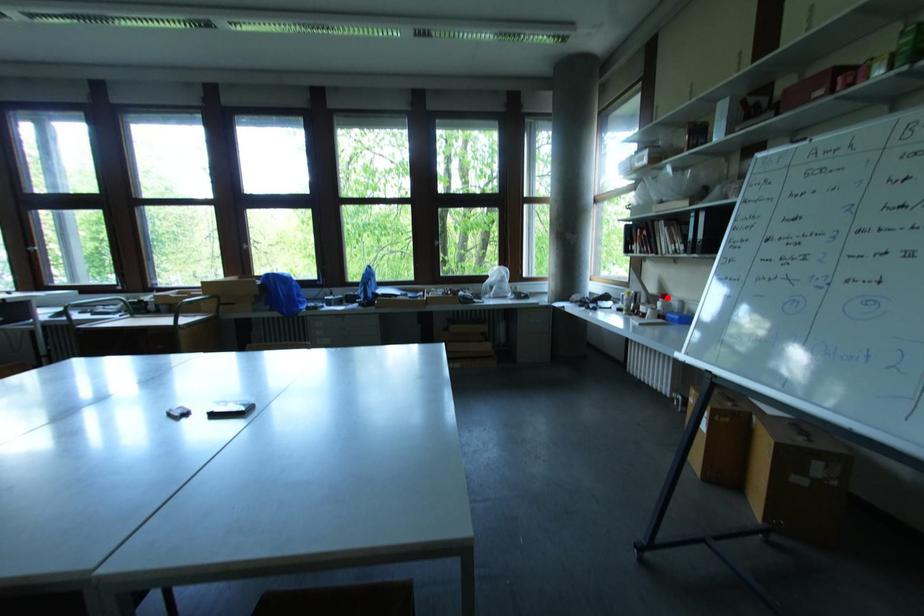
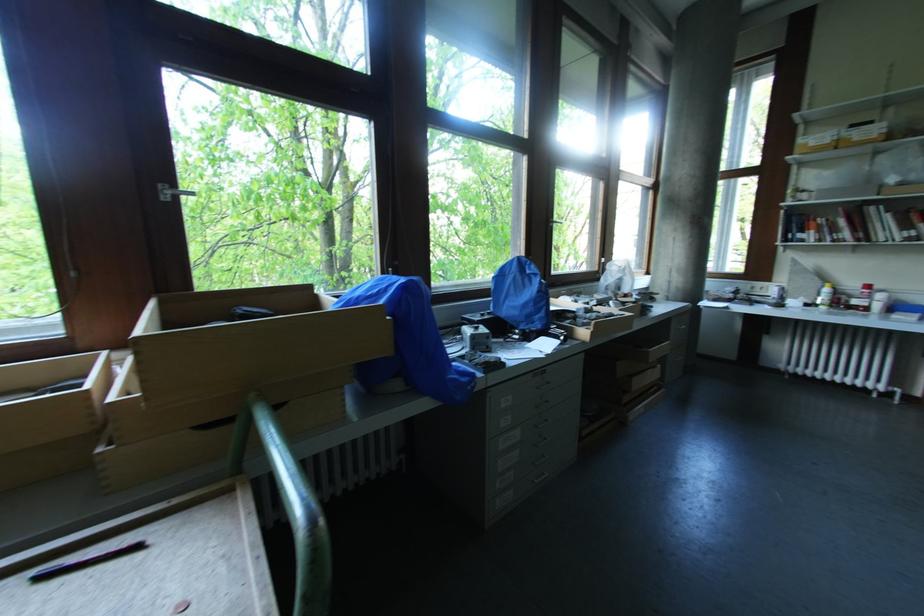
Where in the second image is the point corresponding to the highlighted location from the first image?

(871, 288)